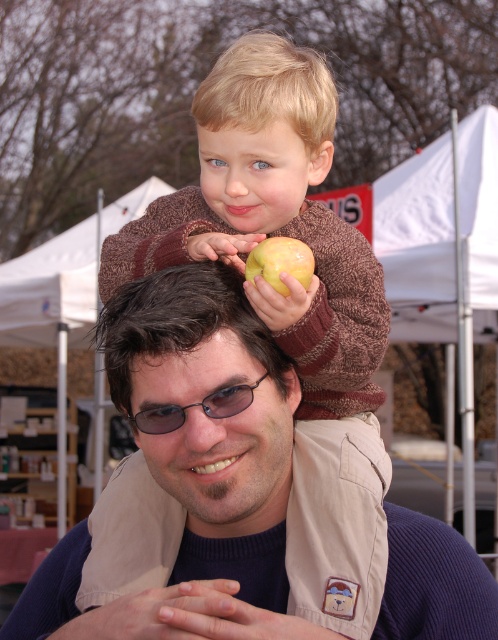
You are a photographer trying to capture the best angle of the scene. You notice the matte brown vest at center and the blonde hair at upper center. Which object should you focus on first to ensure it appears larger in the photo?

The matte brown vest at center is closer to the viewer than the blonde hair at upper center, so focusing on the matte brown vest at center first will make it appear larger in the photo.

You are a photographer at the market and want to take a photo of the brown knitted sweater at upper center and the blonde hair at upper center. Which one should you focus on first if you want to capture both in the frame without moving the camera?

The brown knitted sweater at upper center is to the left of blonde hair at upper center, so you should focus on the brown knitted sweater at upper center first to ensure both are in the frame without moving the camera.

You are a photographer trying to capture a closeup of the matte brown vest at center and the brown knitted sweater at upper center. Which one will appear larger in your photo?

The matte brown vest at center will appear larger in the photo because it is closer to the viewer than the brown knitted sweater at upper center.